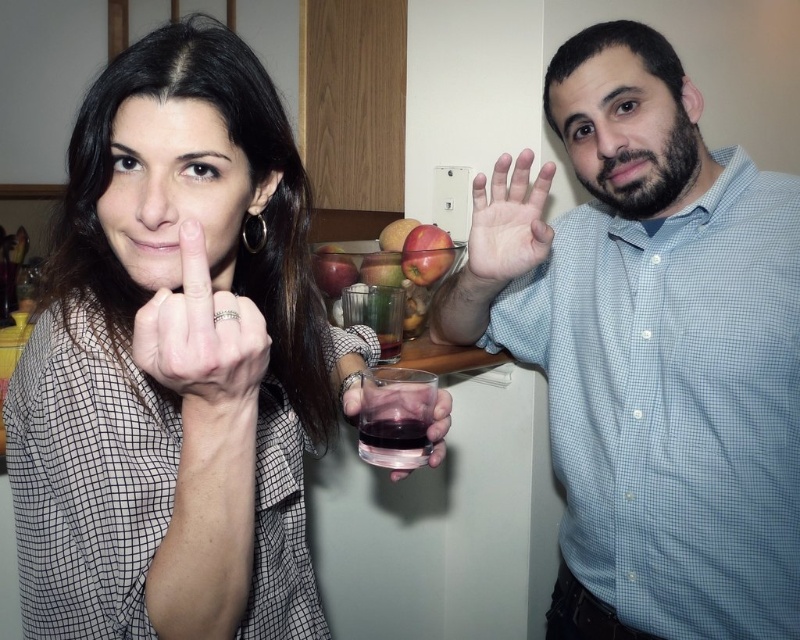
You are at a party and need to choose a glass for a carbonated drink. Which one between the transparent plastic wine glass at center and the translucent glass at center would be more suitable based on their sizes?

The translucent glass at center is taller than the transparent plastic wine glass at center, so it would be more suitable for a carbonated drink as taller glasses are better for such drinks to allow for fizz and headspace.

You are a photographer trying to capture a candid shot of both the light blue checkered shirt at right and the transparent plastic wine glass at center. Based on their positions, can you tell if the wine glass will be fully visible in the shot without being blocked by the shirt?

The transparent plastic wine glass at center is behind the light blue checkered shirt at right, so part of the wine glass may be obscured by the shirt in the photo.

You are trying to determine which object is taller between the matte black shirt at left and the red matte apple at center in the scene. Based on the description provided, which one is taller?

The matte black shirt at left is taller than the red matte apple at center according to the description.